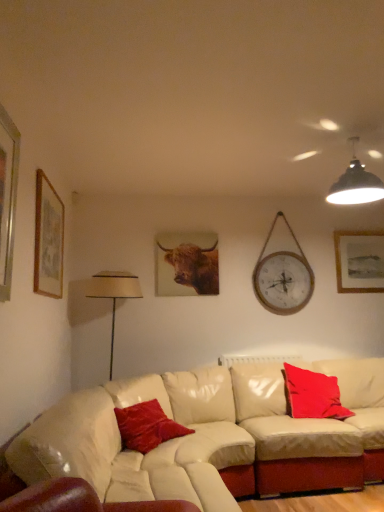
Locate an element on the screen. This screenshot has height=512, width=384. free space above wooden framed artwork at upper right, the 3th picture frame positioned from the left (from a real-world perspective) is located at coordinates tap(364, 226).